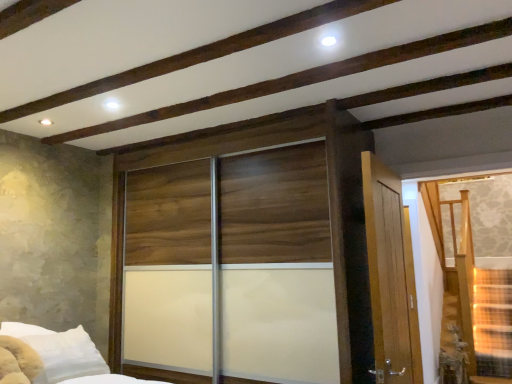
Where is `translucent glass door at right`? The width and height of the screenshot is (512, 384). translucent glass door at right is located at coordinates 476,267.

What is the approximate height of translucent glass door at right?

The height of translucent glass door at right is 1.39 meters.

The width and height of the screenshot is (512, 384). What do you see at coordinates (476, 267) in the screenshot?
I see `translucent glass door at right` at bounding box center [476, 267].

Measure the distance between wooden sliding door at center and camera.

The distance of wooden sliding door at center from camera is 2.15 meters.

Where is `wooden sliding door at center`? Image resolution: width=512 pixels, height=384 pixels. wooden sliding door at center is located at coordinates [277, 267].

Image resolution: width=512 pixels, height=384 pixels. Describe the element at coordinates (277, 267) in the screenshot. I see `wooden sliding door at center` at that location.

This screenshot has width=512, height=384. I want to click on translucent glass door at right, so click(x=476, y=267).

Would you say wooden sliding door at center is to the left or to the right of translucent glass door at right in the picture?

wooden sliding door at center is positioned on translucent glass door at right's left side.

Does wooden sliding door at center lie behind translucent glass door at right?

That is False.

Does point (200, 297) lie in front of point (503, 328)?

Yes, it is.

From the image's perspective, relative to translucent glass door at right, is wooden sliding door at center above or below?

Clearly, from the image's perspective, wooden sliding door at center is below translucent glass door at right.

From a real-world perspective, who is located lower, wooden sliding door at center or translucent glass door at right?

translucent glass door at right is physically lower.

Considering the sizes of objects wooden sliding door at center and translucent glass door at right in the image provided, who is thinner, wooden sliding door at center or translucent glass door at right?

translucent glass door at right is thinner.

Considering the relative sizes of wooden sliding door at center and translucent glass door at right in the image provided, is wooden sliding door at center taller than translucent glass door at right?

Indeed, wooden sliding door at center has a greater height compared to translucent glass door at right.

Is wooden sliding door at center smaller than translucent glass door at right?

Incorrect, wooden sliding door at center is not smaller in size than translucent glass door at right.

Is wooden sliding door at center situated inside translucent glass door at right or outside?

wooden sliding door at center exists outside the volume of translucent glass door at right.

Is wooden sliding door at center positioned far away from translucent glass door at right?

Yes.

Does wooden sliding door at center turn towards translucent glass door at right?

No, wooden sliding door at center does not turn towards translucent glass door at right.

Can you tell me how much wooden sliding door at center and translucent glass door at right differ in facing direction?

The angular difference between wooden sliding door at center and translucent glass door at right is 1.18 degrees.

Image resolution: width=512 pixels, height=384 pixels. Identify the location of screen door that appears above the translucent glass door at right (from a real-world perspective). (277, 267).

Considering the relative positions of translucent glass door at right and wooden sliding door at center in the image provided, is translucent glass door at right to the left of wooden sliding door at center from the viewer's perspective?

No, translucent glass door at right is not to the left of wooden sliding door at center.

In the image, is translucent glass door at right positioned in front of or behind wooden sliding door at center?

Clearly, translucent glass door at right is behind wooden sliding door at center.

Considering the points (443, 296) and (205, 261), which point is behind, point (443, 296) or point (205, 261)?

Positioned behind is point (443, 296).

From the image's perspective, is translucent glass door at right below wooden sliding door at center?

No.

From a real-world perspective, who is located lower, translucent glass door at right or wooden sliding door at center?

From a 3D spatial view, translucent glass door at right is below.

Considering the sizes of objects translucent glass door at right and wooden sliding door at center in the image provided, who is thinner, translucent glass door at right or wooden sliding door at center?

translucent glass door at right.

Can you confirm if translucent glass door at right is shorter than wooden sliding door at center?

Yes, translucent glass door at right is shorter than wooden sliding door at center.

Considering the relative sizes of translucent glass door at right and wooden sliding door at center in the image provided, is translucent glass door at right bigger than wooden sliding door at center?

Actually, translucent glass door at right might be smaller than wooden sliding door at center.

Would you say translucent glass door at right is inside or outside wooden sliding door at center?

translucent glass door at right exists outside the volume of wooden sliding door at center.

Is translucent glass door at right with wooden sliding door at center?

translucent glass door at right and wooden sliding door at center are clearly separated.

Is translucent glass door at right oriented away from wooden sliding door at center?

No, translucent glass door at right is not facing away from wooden sliding door at center.

How distant is translucent glass door at right from wooden sliding door at center?

They are 12.53 feet apart.

Where is `window on the right of wooden sliding door at center`? window on the right of wooden sliding door at center is located at coordinates (476, 267).

What are the coordinates of `screen door to the left of translucent glass door at right` in the screenshot? It's located at (277, 267).

Find the location of a particular element. screen door below the translucent glass door at right (from the image's perspective) is located at coordinates (277, 267).